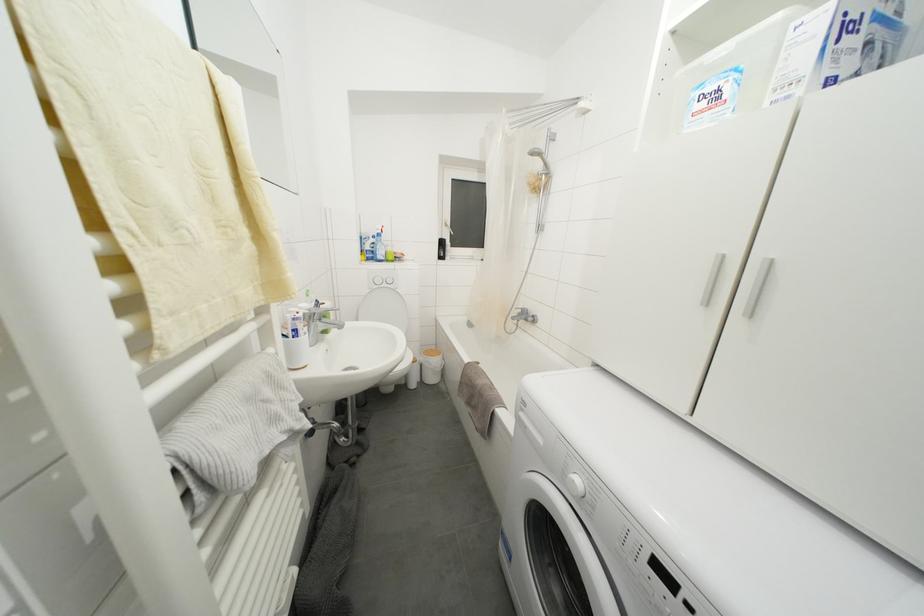
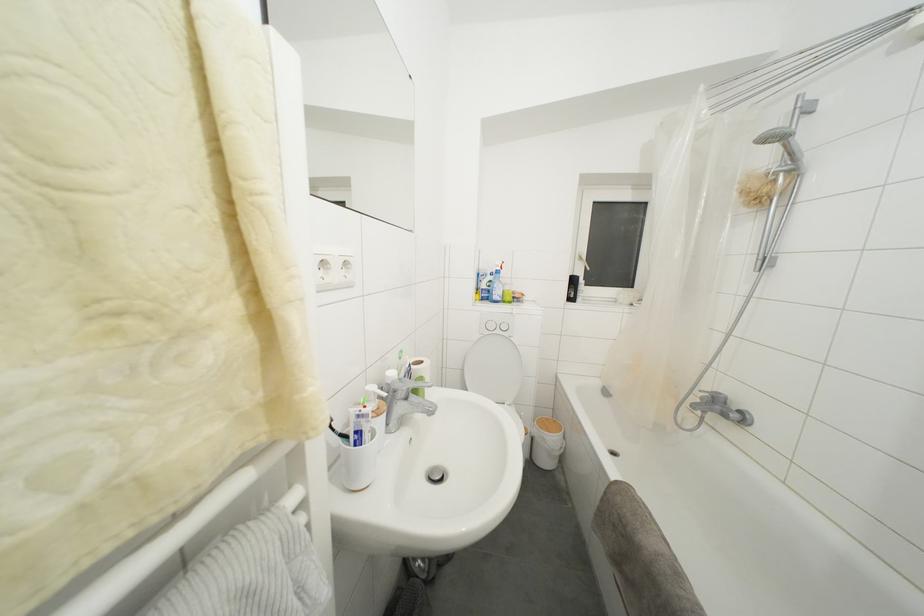
Where in the second image is the point corresponding to point (429, 370) from the first image?

(541, 445)